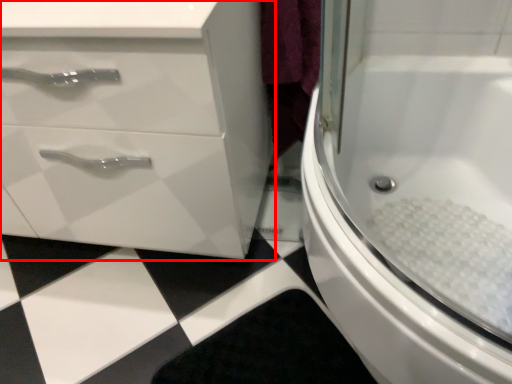
Question: From the image's perspective, where is bathroom cabinet (annotated by the red box) located in relation to bath in the image?

Choices:
 (A) above
 (B) below

Answer: (A)